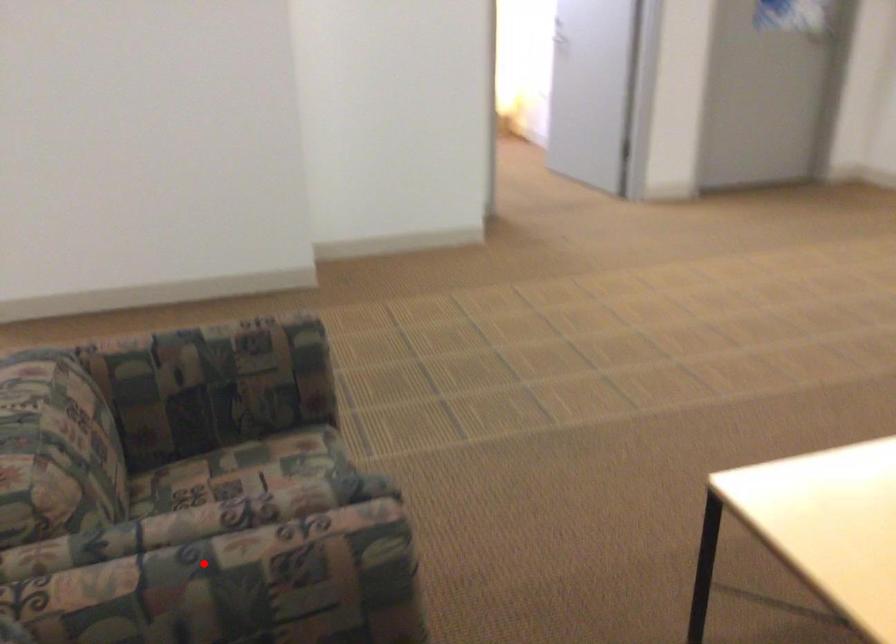
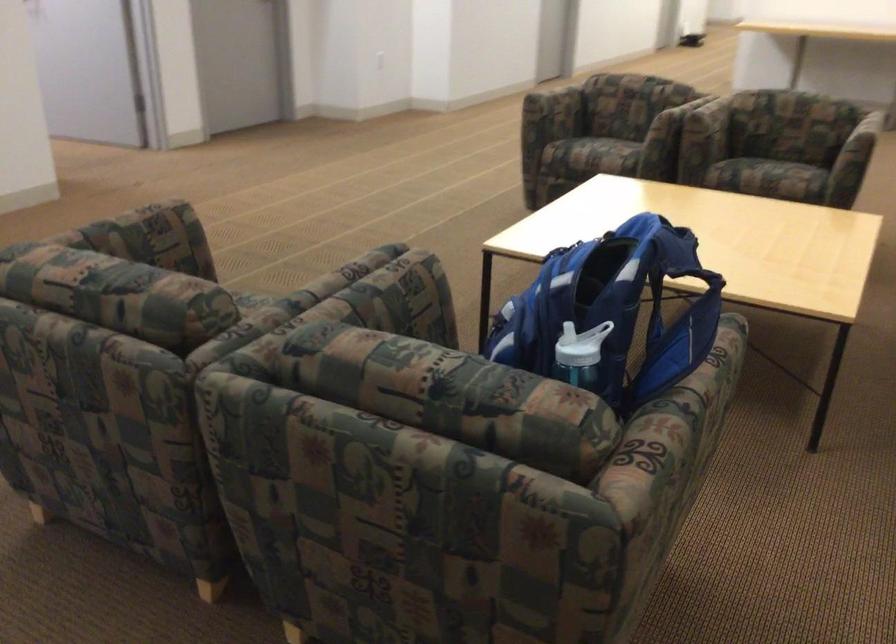
Question: A red point is marked in image1. In image2, is the corresponding 3D point closer to the camera or farther? Reply with the corresponding letter.

Choices:
 (A) The corresponding 3D point is closer.
 (B) The corresponding 3D point is farther.

Answer: (B)